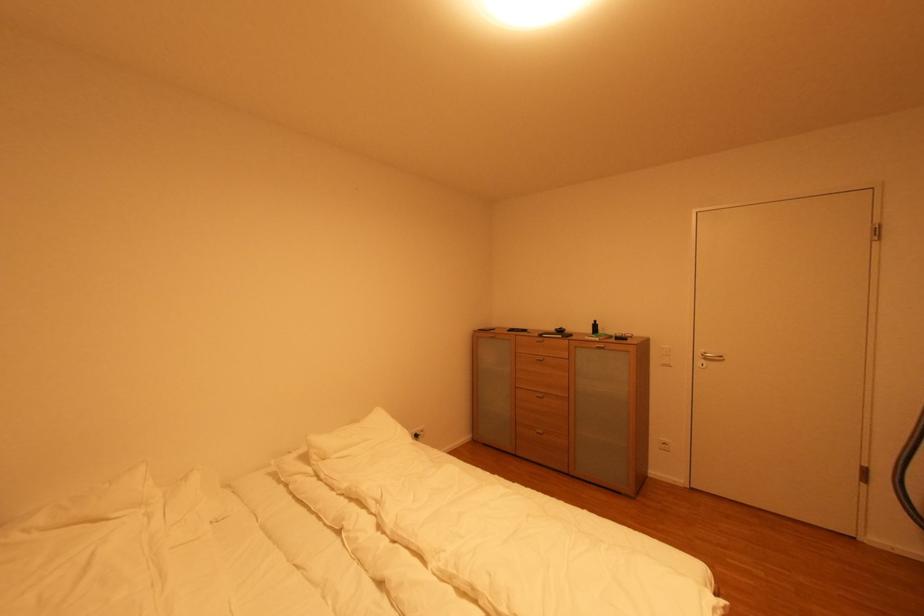
The image size is (924, 616). I want to click on silver door handle, so click(x=707, y=359).